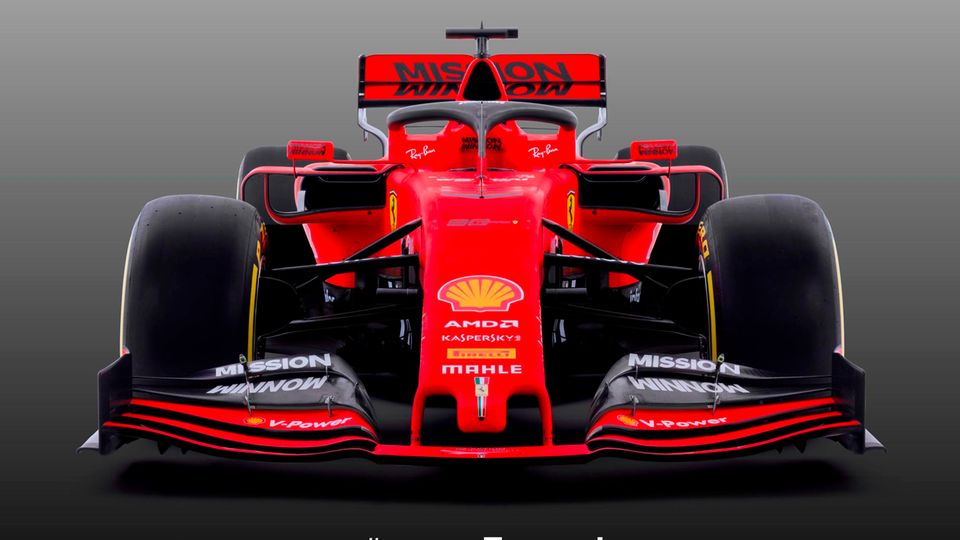
Where is `red paint`? The width and height of the screenshot is (960, 540). red paint is located at coordinates (489, 237), (584, 73), (750, 415), (226, 415), (517, 295).